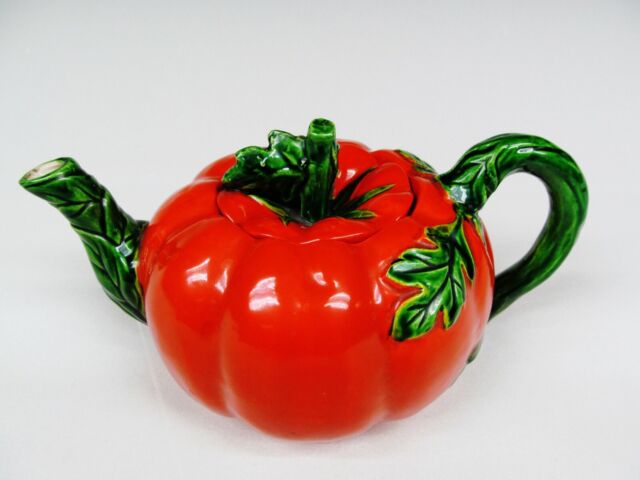
Find the location of `white table top`. white table top is located at coordinates (529, 396).